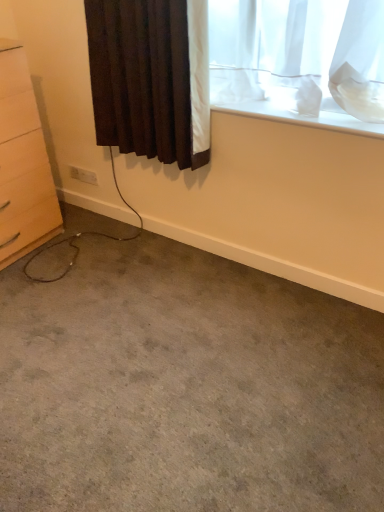
In order to click on brown textured curtain at upper left in this screenshot , I will do `click(142, 78)`.

This screenshot has height=512, width=384. I want to click on brown textured curtain at upper left, so click(x=142, y=78).

Is brown textured curtain at upper left not inside gray carpet at lower center?

Indeed, brown textured curtain at upper left is completely outside gray carpet at lower center.

Between brown textured curtain at upper left and gray carpet at lower center, which one has smaller size?

brown textured curtain at upper left is smaller.

From the image's perspective, is brown textured curtain at upper left on gray carpet at lower center?

Yes, from the image's perspective, brown textured curtain at upper left is on top of gray carpet at lower center.

Between point (137, 89) and point (9, 394), which one is positioned in front?

Positioned in front is point (9, 394).

Considering the sizes of light wood chest of drawers at left and white plastic electric outlet at lower left in the image, is light wood chest of drawers at left wider or thinner than white plastic electric outlet at lower left?

Clearly, light wood chest of drawers at left has more width compared to white plastic electric outlet at lower left.

The width and height of the screenshot is (384, 512). Find the location of `the chest of drawers above the white plastic electric outlet at lower left (from a real-world perspective)`. the chest of drawers above the white plastic electric outlet at lower left (from a real-world perspective) is located at coordinates (23, 163).

In the scene shown: Is light wood chest of drawers at left oriented away from white plastic electric outlet at lower left?

No, light wood chest of drawers at left's orientation is not away from white plastic electric outlet at lower left.

Looking at this image, between light wood chest of drawers at left and white plastic electric outlet at lower left, which one appears on the right side from the viewer's perspective?

From the viewer's perspective, white plastic electric outlet at lower left appears more on the right side.

Are white plastic electric outlet at lower left and gray carpet at lower center far apart?

Yes.

There is a gray carpet at lower center. Where is `electric outlet above it (from a real-world perspective)`? The width and height of the screenshot is (384, 512). electric outlet above it (from a real-world perspective) is located at coordinates (83, 175).

From their relative heights in the image, would you say white plastic electric outlet at lower left is taller or shorter than gray carpet at lower center?

white plastic electric outlet at lower left is taller than gray carpet at lower center.

From the picture: Is white plastic electric outlet at lower left inside or outside of gray carpet at lower center?

white plastic electric outlet at lower left is located beyond the bounds of gray carpet at lower center.

Consider the image. Is white plastic electric outlet at lower left in contact with white matte window sill at upper right?

white plastic electric outlet at lower left is not next to white matte window sill at upper right, and they're not touching.

Which is more to the right, white plastic electric outlet at lower left or white matte window sill at upper right?

white matte window sill at upper right is more to the right.

Considering the positions of objects white plastic electric outlet at lower left and white matte window sill at upper right in the image provided, who is in front, white plastic electric outlet at lower left or white matte window sill at upper right?

Positioned in front is white matte window sill at upper right.

Is white plastic electric outlet at lower left oriented away from white matte window sill at upper right?

white plastic electric outlet at lower left does not have its back to white matte window sill at upper right.

Is white plastic electric outlet at lower left surrounding brown textured curtain at upper left?

No, white plastic electric outlet at lower left does not contain brown textured curtain at upper left.

Is white plastic electric outlet at lower left aimed at brown textured curtain at upper left?

No, white plastic electric outlet at lower left does not turn towards brown textured curtain at upper left.

Which object is thinner, white plastic electric outlet at lower left or brown textured curtain at upper left?

white plastic electric outlet at lower left.

Would you consider white plastic electric outlet at lower left to be distant from brown textured curtain at upper left?

Actually, white plastic electric outlet at lower left and brown textured curtain at upper left are a little close together.

From a real-world perspective, who is located higher, gray carpet at lower center or brown textured curtain at upper left?

brown textured curtain at upper left is physically above.

Looking at this image, how different are the orientations of gray carpet at lower center and brown textured curtain at upper left in degrees?

They differ by 88.8 degrees in their facing directions.

From the image's perspective, between gray carpet at lower center and brown textured curtain at upper left, who is located below?

gray carpet at lower center, from the image's perspective.

Is gray carpet at lower center oriented towards brown textured curtain at upper left?

No, gray carpet at lower center is not facing towards brown textured curtain at upper left.

How many degrees apart are the facing directions of white matte window sill at upper right and brown textured curtain at upper left?

1.17 degrees separate the facing orientations of white matte window sill at upper right and brown textured curtain at upper left.

Considering the positions of objects white matte window sill at upper right and brown textured curtain at upper left in the image provided, who is behind, white matte window sill at upper right or brown textured curtain at upper left?

white matte window sill at upper right is behind.

Does white matte window sill at upper right have a lesser width compared to brown textured curtain at upper left?

In fact, white matte window sill at upper right might be wider than brown textured curtain at upper left.

How far apart are white matte window sill at upper right and brown textured curtain at upper left?

white matte window sill at upper right and brown textured curtain at upper left are 16.11 inches apart.

In the image, there is a brown textured curtain at upper left. What are the coordinates of `concrete below it (from a real-world perspective)` in the screenshot? It's located at (185, 388).

The width and height of the screenshot is (384, 512). Identify the location of electric outlet on the right of light wood chest of drawers at left. (83, 175).

Which object lies further to the anchor point white plastic electric outlet at lower left, gray carpet at lower center or white matte window sill at upper right?

gray carpet at lower center lies further to white plastic electric outlet at lower left than the other object.

Considering their positions, is light wood chest of drawers at left positioned closer to white plastic electric outlet at lower left than gray carpet at lower center?

The object closer to white plastic electric outlet at lower left is light wood chest of drawers at left.

Considering their positions, is gray carpet at lower center positioned further to light wood chest of drawers at left than brown textured curtain at upper left?

gray carpet at lower center is further to light wood chest of drawers at left.

Looking at the image, which one is located further to gray carpet at lower center, light wood chest of drawers at left or white plastic electric outlet at lower left?

The object further to gray carpet at lower center is white plastic electric outlet at lower left.

From the image, which object appears to be nearer to white plastic electric outlet at lower left, white matte window sill at upper right or gray carpet at lower center?

Based on the image, white matte window sill at upper right appears to be nearer to white plastic electric outlet at lower left.

From the image, which object appears to be farther from light wood chest of drawers at left, white matte window sill at upper right or brown textured curtain at upper left?

white matte window sill at upper right.

Estimate the real-world distances between objects in this image. Which object is further from brown textured curtain at upper left, light wood chest of drawers at left or white plastic electric outlet at lower left?

white plastic electric outlet at lower left is further to brown textured curtain at upper left.

Which object lies nearer to the anchor point white matte window sill at upper right, gray carpet at lower center or light wood chest of drawers at left?

Based on the image, gray carpet at lower center appears to be nearer to white matte window sill at upper right.

Where is `curtain between gray carpet at lower center and white plastic electric outlet at lower left from front to back`? The height and width of the screenshot is (512, 384). curtain between gray carpet at lower center and white plastic electric outlet at lower left from front to back is located at coordinates (142, 78).

You are a GUI agent. You are given a task and a screenshot of the screen. Output one action in this format:
    pyautogui.click(x=<x>, y=<y>)
    Task: Click on the chest of drawers positioned between gray carpet at lower center and white plastic electric outlet at lower left from near to far
    The image size is (384, 512).
    Given the screenshot: What is the action you would take?
    pyautogui.click(x=23, y=163)

At what (x,y) coordinates should I click in order to perform the action: click on window sill between brown textured curtain at upper left and gray carpet at lower center in the up-down direction. Please return your answer as a coordinate pair (x, y). Looking at the image, I should click on (300, 115).

The height and width of the screenshot is (512, 384). In order to click on concrete located between light wood chest of drawers at left and white matte window sill at upper right in the left-right direction in this screenshot , I will do `click(185, 388)`.